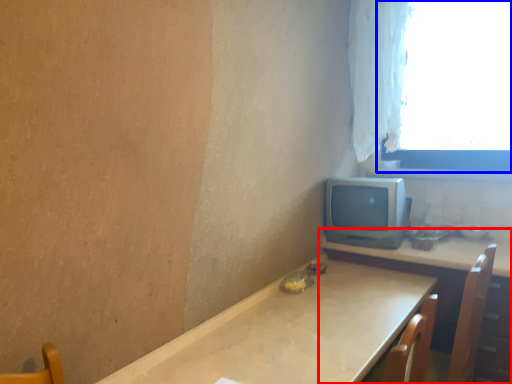
Question: Which point is closer to the camera, table (highlighted by a red box) or window (highlighted by a blue box)?

Choices:
 (A) table
 (B) window

Answer: (A)